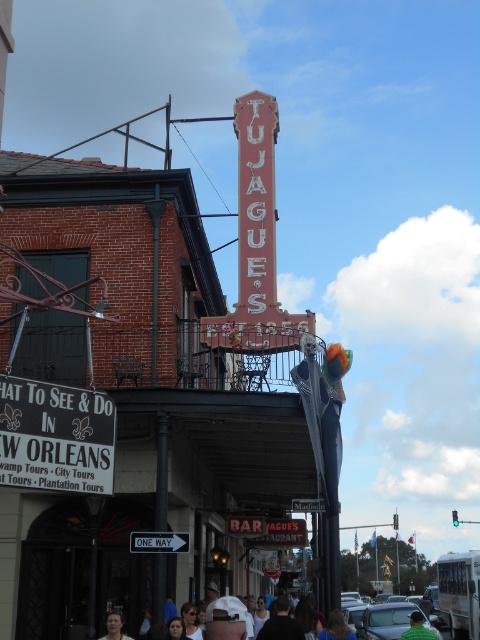
Locate an element on the screen. This screenshot has height=640, width=480. white paper sign at lower left is located at coordinates (56, 436).

Can you confirm if white paper sign at lower left is positioned above matte black shirt at lower center?

Yes.

Between point (46, 406) and point (404, 605), which one is positioned in front?

Point (46, 406) is in front.

This screenshot has height=640, width=480. What are the coordinates of `white paper sign at lower left` in the screenshot? It's located at (56, 436).

Can you confirm if white paper sign at lower left is positioned below smooth skin face at lower center?

Actually, white paper sign at lower left is above smooth skin face at lower center.

Which is in front, point (49, 396) or point (111, 611)?

Point (49, 396) is more forward.

Locate an element on the screen. This screenshot has width=480, height=640. white paper sign at lower left is located at coordinates (56, 436).

Which is behind, point (154, 544) or point (111, 612)?

Positioned behind is point (154, 544).

Does white plastic sign at center have a greater width compared to smooth skin face at lower center?

In fact, white plastic sign at center might be narrower than smooth skin face at lower center.

Measure the distance between point (178,534) and camera.

Point (178,534) is 52.88 meters away from camera.

I want to click on white plastic sign at center, so click(158, 541).